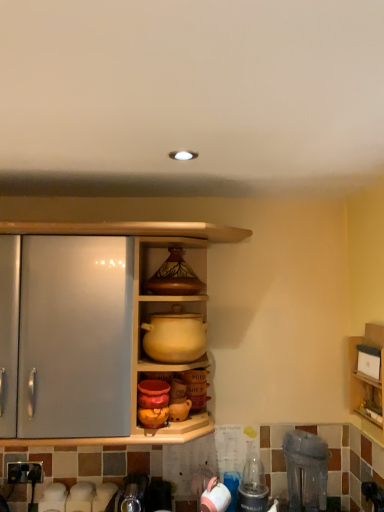
Question: Which direction should I rotate to look at white glossy kettle at lower center, which is the first appliance from left to right?

Choices:
 (A) left
 (B) right

Answer: (B)

Question: Does matte yellow pot at center, which appears as the second shelf when viewed from the right, have a larger size compared to clear plastic bottle at lower right?

Choices:
 (A) no
 (B) yes

Answer: (B)

Question: From a real-world perspective, is matte yellow pot at center, which appears as the second shelf when viewed from the right, below clear plastic bottle at lower right?

Choices:
 (A) yes
 (B) no

Answer: (B)

Question: Does matte yellow pot at center, acting as the first shelf starting from the left, have a greater width compared to clear plastic bottle at lower right?

Choices:
 (A) yes
 (B) no

Answer: (A)

Question: Is matte yellow pot at center, which appears as the second shelf when viewed from the right, located outside clear plastic bottle at lower right?

Choices:
 (A) yes
 (B) no

Answer: (A)

Question: Would you consider matte yellow pot at center, acting as the first shelf starting from the left, to be distant from clear plastic bottle at lower right?

Choices:
 (A) no
 (B) yes

Answer: (A)

Question: From the image's perspective, would you say matte yellow pot at center, acting as the first shelf starting from the left, is positioned over clear plastic bottle at lower right?

Choices:
 (A) yes
 (B) no

Answer: (A)

Question: From a real-world perspective, is wooden shelf at right, acting as the 1th shelf starting from the right, physically below white glossy kettle at lower center, the second appliance from the right?

Choices:
 (A) no
 (B) yes

Answer: (A)

Question: Can you confirm if wooden shelf at right, acting as the second shelf starting from the left, is shorter than white glossy kettle at lower center, which is the first appliance from left to right?

Choices:
 (A) no
 (B) yes

Answer: (A)

Question: Is wooden shelf at right, acting as the 1th shelf starting from the right, placed right next to white glossy kettle at lower center, which is the first appliance from left to right?

Choices:
 (A) no
 (B) yes

Answer: (A)

Question: Does wooden shelf at right, acting as the second shelf starting from the left, appear on the left side of white glossy kettle at lower center, the second appliance from the right?

Choices:
 (A) yes
 (B) no

Answer: (B)

Question: Is wooden shelf at right, acting as the second shelf starting from the left, wider than white glossy kettle at lower center, which is the first appliance from left to right?

Choices:
 (A) yes
 (B) no

Answer: (B)

Question: From the image's perspective, does wooden shelf at right, acting as the 1th shelf starting from the right, appear lower than white glossy kettle at lower center, the second appliance from the right?

Choices:
 (A) yes
 (B) no

Answer: (B)

Question: Considering the relative sizes of matte ceramic vase at upper center and wooden shelf at right, acting as the 1th shelf starting from the right, in the image provided, is matte ceramic vase at upper center smaller than wooden shelf at right, acting as the 1th shelf starting from the right,?

Choices:
 (A) yes
 (B) no

Answer: (A)